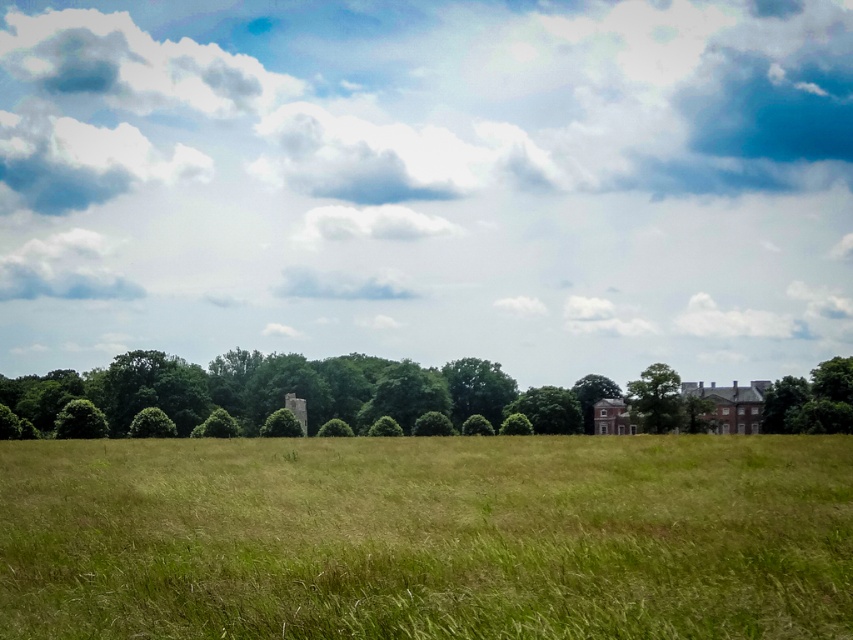
Can you confirm if green grassy field at center is positioned above green leafy tree at center-right?

Indeed, green grassy field at center is positioned over green leafy tree at center-right.

Does point (525, 477) come farther from viewer compared to point (664, 429)?

No.

Is point (604, 602) positioned in front of point (670, 387)?

That is True.

You are a GUI agent. You are given a task and a screenshot of the screen. Output one action in this format:
    pyautogui.click(x=<x>, y=<y>)
    Task: Click on the green grassy field at center
    
    Given the screenshot: What is the action you would take?
    pyautogui.click(x=427, y=538)

Can you confirm if cloudy sky at upper center is positioned to the right of green grassy field at center?

No, cloudy sky at upper center is not to the right of green grassy field at center.

Where is `cloudy sky at upper center`? cloudy sky at upper center is located at coordinates (428, 182).

Between point (618, 42) and point (392, 541), which one is positioned in front?

Positioned in front is point (392, 541).

This screenshot has width=853, height=640. I want to click on cloudy sky at upper center, so click(428, 182).

The width and height of the screenshot is (853, 640). Find the location of `green grassy field at center`. green grassy field at center is located at coordinates (427, 538).

Is green grassy field at center closer to camera compared to green leafy tree at right?

Yes, green grassy field at center is closer to the viewer.

Measure the distance between point (15,492) and camera.

The distance of point (15,492) from camera is 55.06 feet.

Locate an element on the screen. The width and height of the screenshot is (853, 640). green grassy field at center is located at coordinates (427, 538).